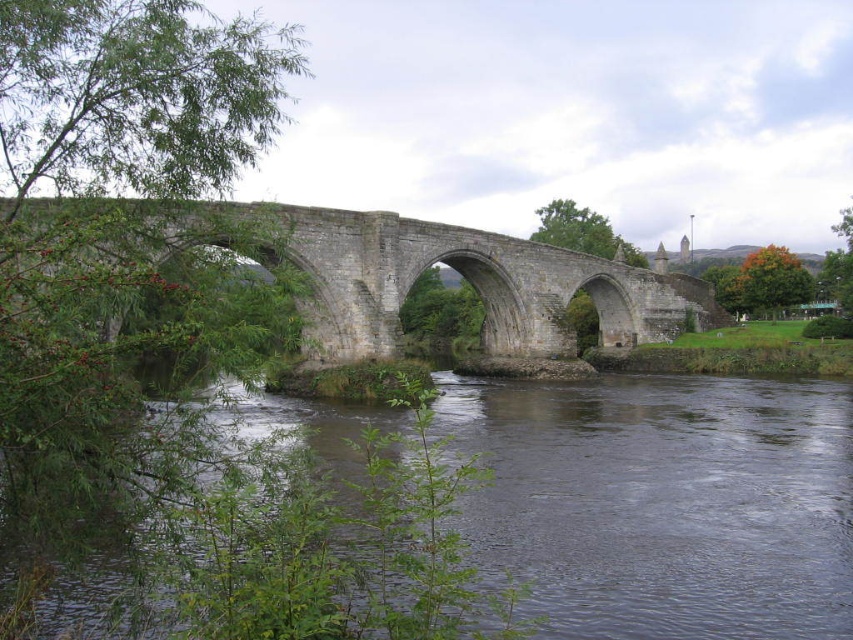
Question: Which point is closer to the camera?

Choices:
 (A) (734, 600)
 (B) (403, 240)

Answer: (A)

Question: Does dark gray water at center have a smaller size compared to stone bridge at center?

Choices:
 (A) yes
 (B) no

Answer: (A)

Question: Where is dark gray water at center located in relation to stone bridge at center in the image?

Choices:
 (A) left
 (B) right

Answer: (B)

Question: Which point is closer to the camera taking this photo?

Choices:
 (A) (651, 400)
 (B) (141, 204)

Answer: (B)

Question: Among these points, which one is farthest from the camera?

Choices:
 (A) (65, 202)
 (B) (544, 596)

Answer: (B)

Question: Can you confirm if dark gray water at center is smaller than stone bridge at center?

Choices:
 (A) no
 (B) yes

Answer: (B)